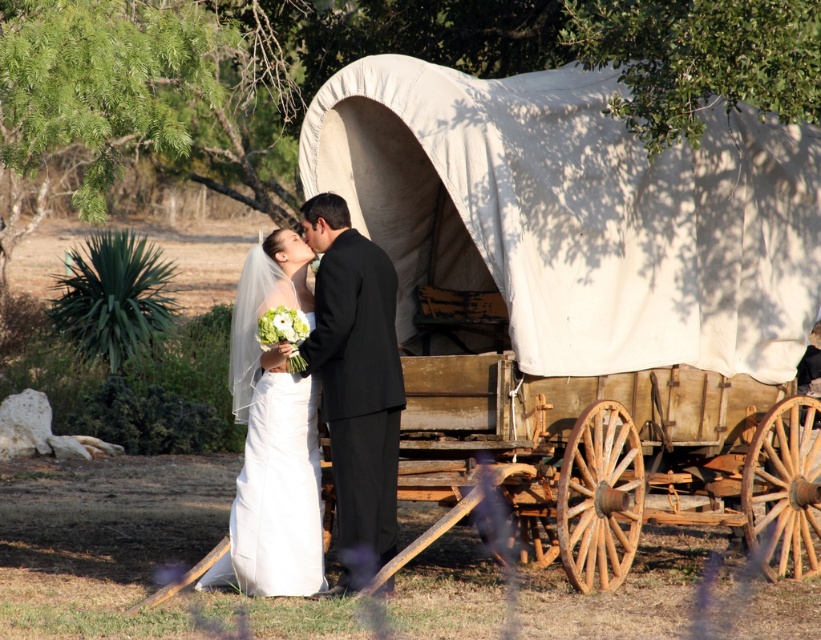
Question: Which object appears farthest from the camera in this image?

Choices:
 (A) black satin suit at center
 (B) white canvas wagon at center
 (C) white satin dress at center

Answer: (B)

Question: Based on their relative distances, which object is farther from the black satin suit at center?

Choices:
 (A) white canvas wagon at center
 (B) white satin dress at center

Answer: (A)

Question: Considering the relative positions of white canvas wagon at center and black satin suit at center in the image provided, where is white canvas wagon at center located with respect to black satin suit at center?

Choices:
 (A) left
 (B) right

Answer: (B)

Question: Among these points, which one is nearest to the camera?

Choices:
 (A) (297, 294)
 (B) (384, 260)
 (C) (666, 198)

Answer: (B)

Question: Considering the relative positions of white satin dress at center and black satin suit at center in the image provided, where is white satin dress at center located with respect to black satin suit at center?

Choices:
 (A) below
 (B) above

Answer: (A)

Question: Does white canvas wagon at center have a lesser width compared to white satin dress at center?

Choices:
 (A) no
 (B) yes

Answer: (A)